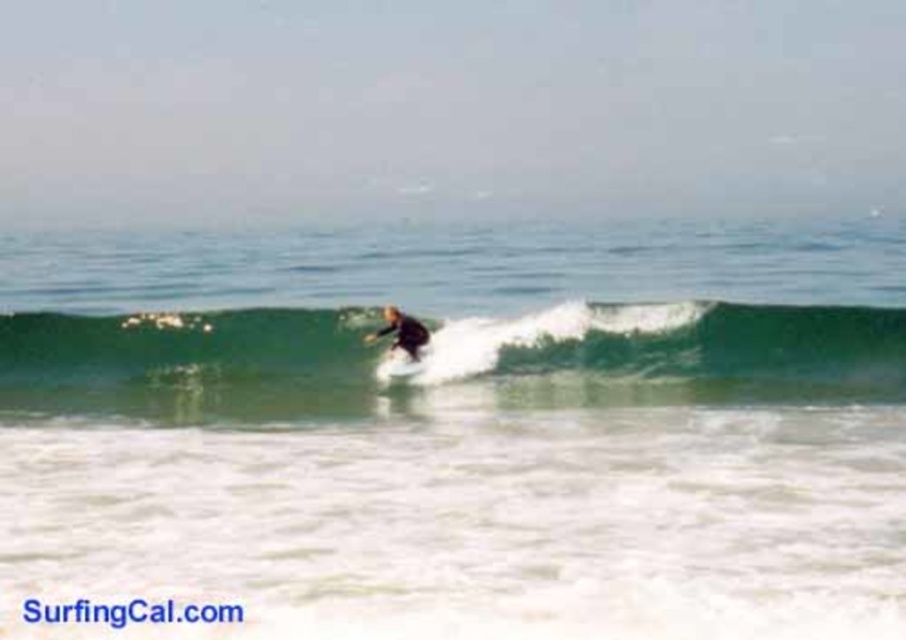
Question: Does green rubber wave at center appear on the right side of black wetsuit surfer at center?

Choices:
 (A) yes
 (B) no

Answer: (A)

Question: Which object is positioned closest to the white foam surfboard at center?

Choices:
 (A) green rubber wave at center
 (B) black wetsuit surfer at center

Answer: (B)

Question: Is green rubber wave at center further to the viewer compared to black wetsuit surfer at center?

Choices:
 (A) no
 (B) yes

Answer: (A)

Question: Which object appears farthest from the camera in this image?

Choices:
 (A) green rubber wave at center
 (B) white foam surfboard at center

Answer: (B)

Question: Which object is positioned farthest from the green rubber wave at center?

Choices:
 (A) black wetsuit surfer at center
 (B) white foam surfboard at center

Answer: (B)

Question: Can you confirm if green rubber wave at center is smaller than white foam surfboard at center?

Choices:
 (A) no
 (B) yes

Answer: (A)